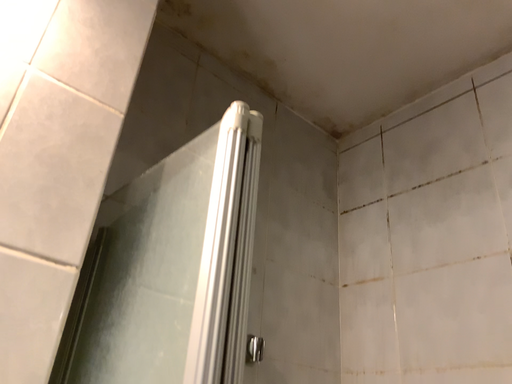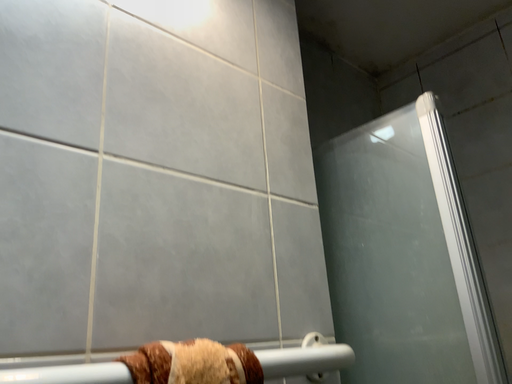
Question: Which way did the camera rotate in the video?

Choices:
 (A) rotated upward
 (B) rotated downward

Answer: (B)